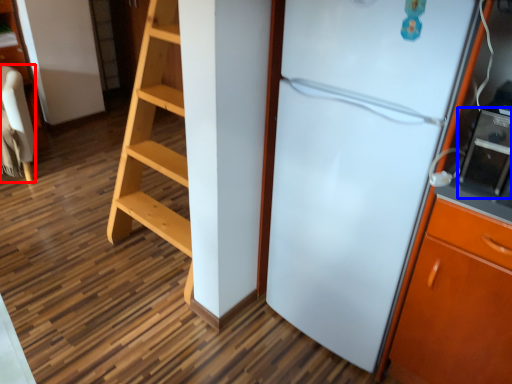
Question: Among these objects, which one is nearest to the camera, furniture (highlighted by a red box) or appliance (highlighted by a blue box)?

Choices:
 (A) furniture
 (B) appliance

Answer: (B)